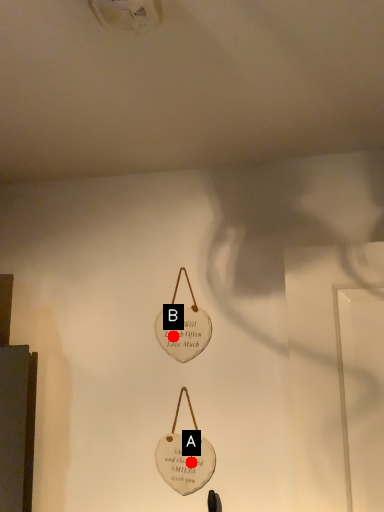
Question: Two points are circled on the image, labeled by A and B beside each circle. Which point appears farthest from the camera in this image?

Choices:
 (A) A is further
 (B) B is further

Answer: (B)